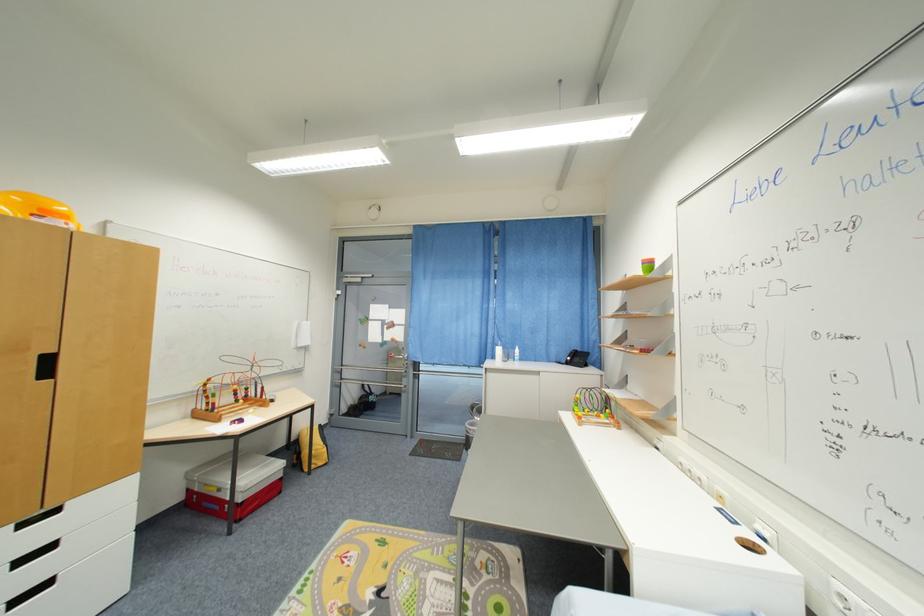
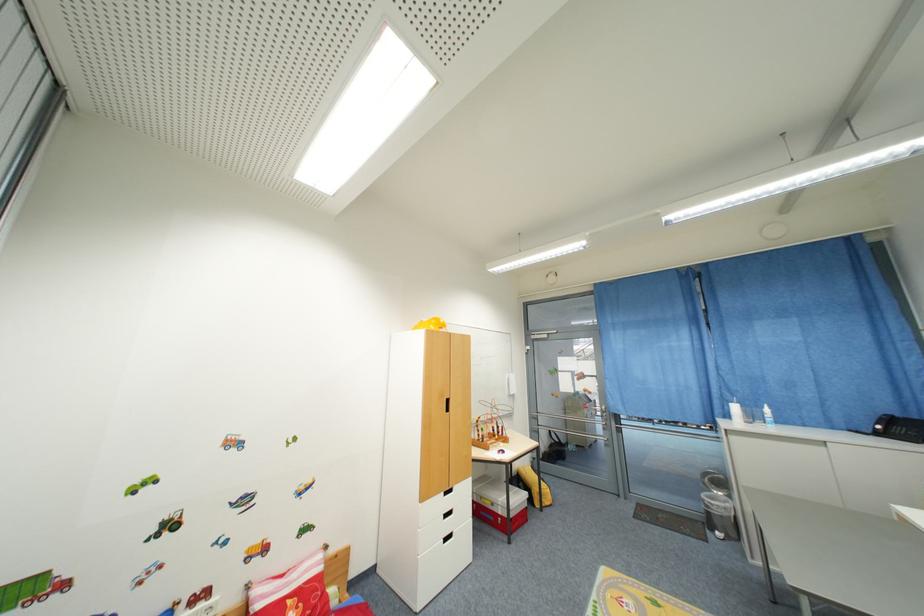
In the second image, find the point that corresponds to (x=519, y=355) in the first image.

(768, 415)